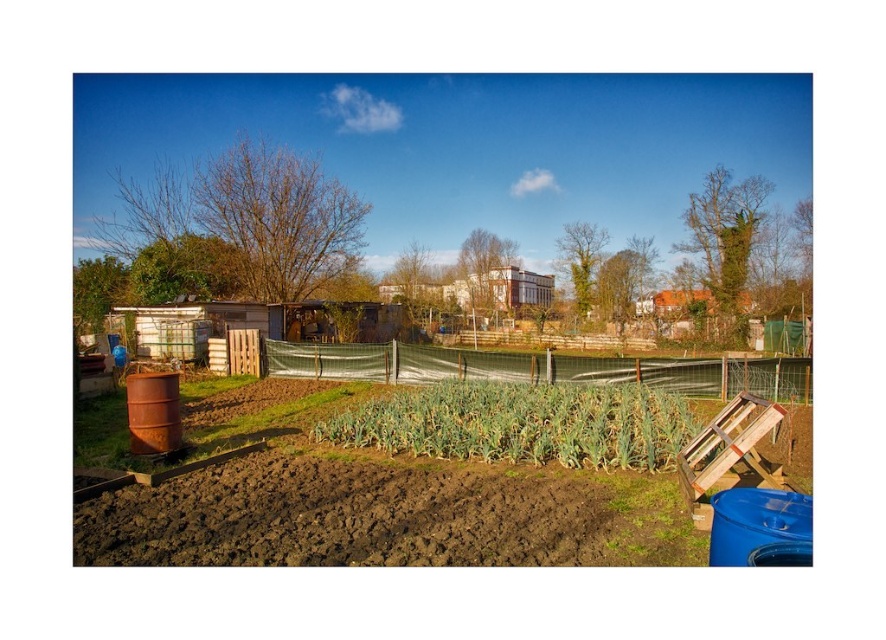
Question: Observing the image, what is the correct spatial positioning of brown soil at center in reference to green leafy plant at center?

Choices:
 (A) left
 (B) right

Answer: (A)

Question: Which point is farther to the camera?

Choices:
 (A) green leafy plant at center
 (B) green mesh fence at center
 (C) brown soil at center

Answer: (B)

Question: Which of the following is the farthest from the observer?

Choices:
 (A) green mesh fence at center
 (B) brown soil at center
 (C) green leafy plant at center

Answer: (A)

Question: Does green leafy plant at center appear over green mesh fence at center?

Choices:
 (A) yes
 (B) no

Answer: (B)

Question: Which object is closer to the camera taking this photo?

Choices:
 (A) green leafy plant at center
 (B) brown soil at center
 (C) green mesh fence at center

Answer: (B)

Question: Can you confirm if brown soil at center is positioned above green leafy plant at center?

Choices:
 (A) yes
 (B) no

Answer: (B)